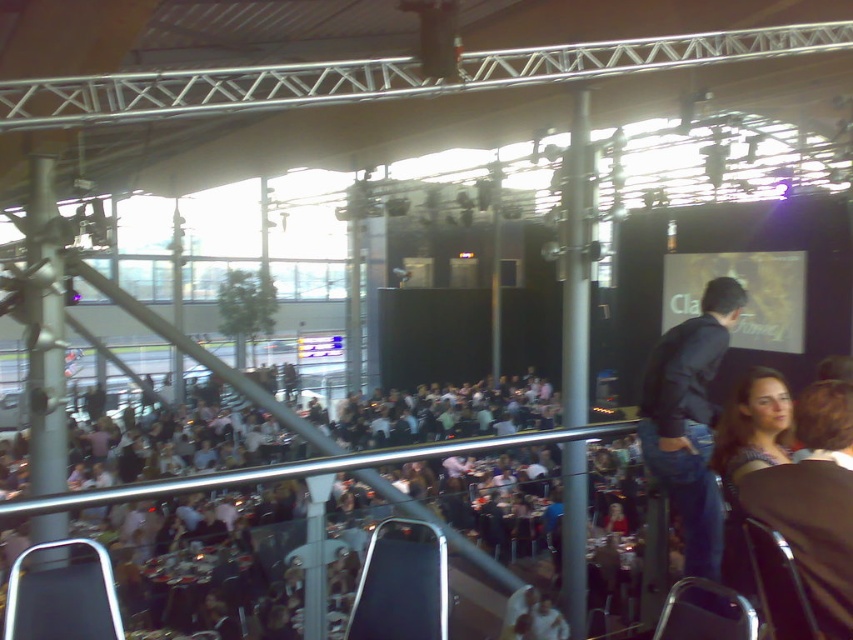
Question: Can you confirm if white fabric crowd at center is positioned below blue denim shirt at lower right?

Choices:
 (A) no
 (B) yes

Answer: (B)

Question: Which point is farther to the camera?

Choices:
 (A) white fabric crowd at center
 (B) dark blue jeans at center
 (C) blue denim shirt at lower right

Answer: (B)

Question: Which point is farther to the camera?

Choices:
 (A) (741, 292)
 (B) (753, 378)

Answer: (A)

Question: Can you confirm if white fabric crowd at center is positioned below dark blue jeans at center?

Choices:
 (A) yes
 (B) no

Answer: (A)

Question: Is dark blue jeans at center thinner than blue denim shirt at lower right?

Choices:
 (A) no
 (B) yes

Answer: (A)

Question: Which object is the closest to the blue denim shirt at lower right?

Choices:
 (A) dark blue jeans at center
 (B) white fabric crowd at center

Answer: (A)